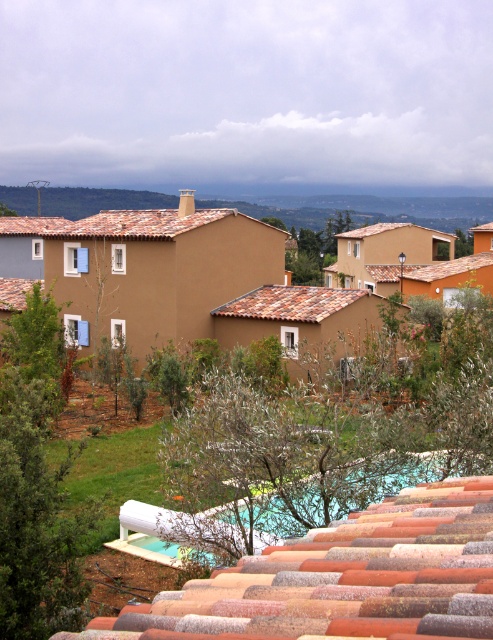
You are standing in the residential area and want to take a photo of the green leafy tree at center. If your camera has a maximum focus range of 25 feet, will you need to move closer to capture it clearly?

The green leafy tree at center is 28.19 feet away from the viewer, which exceeds the camera maximum focus range of 25 feet. Therefore, you need to move closer to ensure the tree is in focus.

You are standing in the residential area and want to find shade. Which object would provide more shade, the green leafy tree at center or the brown clay tiles at left?

The green leafy tree at center is positioned under brown clay tiles at left, so the brown clay tiles at left would provide more shade as they are above the tree and likely part of a roof structure casting a larger shadow.